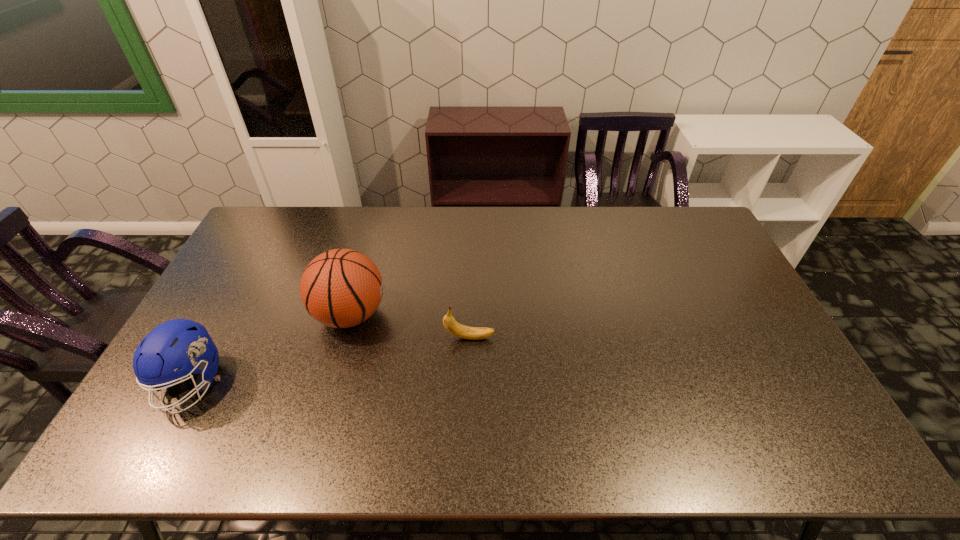
In order to click on vacant space at the far edge in this screenshot , I will do `click(521, 241)`.

Where is `free space at the near edge of the desktop`? free space at the near edge of the desktop is located at coordinates (199, 446).

In the image, there is a desktop. What are the coordinates of `vacant space at the left edge` in the screenshot? It's located at (252, 255).

Locate an element on the screen. This screenshot has width=960, height=540. free region at the right edge of the desktop is located at coordinates (745, 355).

You are a GUI agent. You are given a task and a screenshot of the screen. Output one action in this format:
    pyautogui.click(x=<x>, y=<y>)
    Task: Click on the vacant space at the far left corner of the desktop
    The image size is (960, 540).
    Given the screenshot: What is the action you would take?
    pyautogui.click(x=267, y=219)

Locate an element on the screen. free location at the near left corner is located at coordinates (128, 458).

This screenshot has width=960, height=540. Identify the location of free point at the far right corner. (657, 209).

The image size is (960, 540). Find the location of `vacant space at the near right corner of the desktop`. vacant space at the near right corner of the desktop is located at coordinates (784, 442).

Find the location of a particular element. The width and height of the screenshot is (960, 540). unoccupied area between the banana and the tallest object is located at coordinates (410, 326).

Find the location of `vacant area that lies between the shortest object and the tallest object`. vacant area that lies between the shortest object and the tallest object is located at coordinates (410, 326).